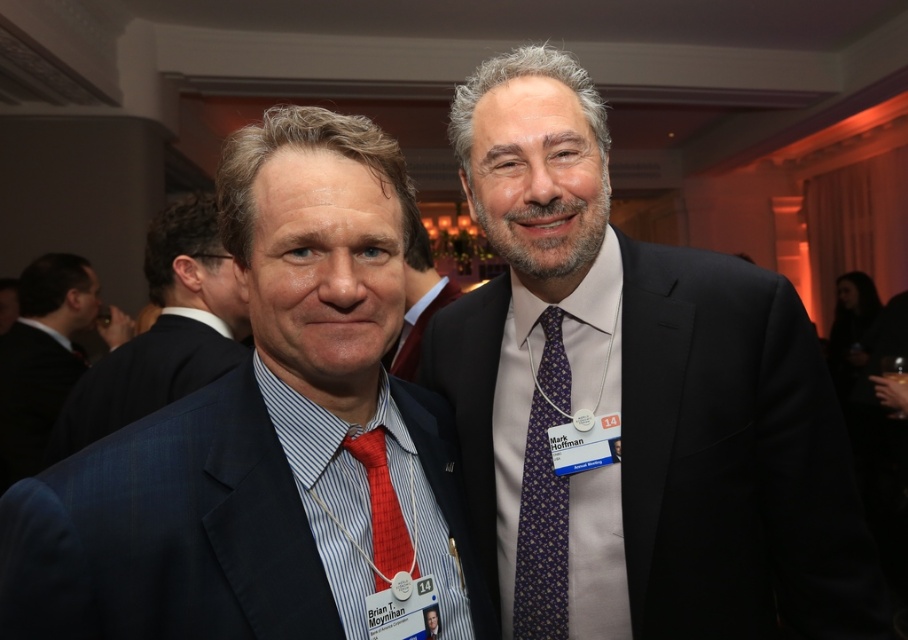
Question: Is blue textured suit at left below purple silk tie at right?

Choices:
 (A) no
 (B) yes

Answer: (A)

Question: Which point is closer to the camera?

Choices:
 (A) blue textured suit at left
 (B) matte blue suit at left
 (C) red woven tie at center
 (D) purple silk tie at right

Answer: (B)

Question: Can you confirm if red woven tie at center is positioned to the right of matte black suit at center?

Choices:
 (A) no
 (B) yes

Answer: (B)

Question: Among these objects, which one is nearest to the camera?

Choices:
 (A) matte black suit at left
 (B) matte black suit at center

Answer: (B)

Question: Which point is closer to the camera taking this photo?

Choices:
 (A) (684, 337)
 (B) (191, 390)

Answer: (A)

Question: Does dark gray suit at right appear under blue textured suit at left?

Choices:
 (A) yes
 (B) no

Answer: (B)